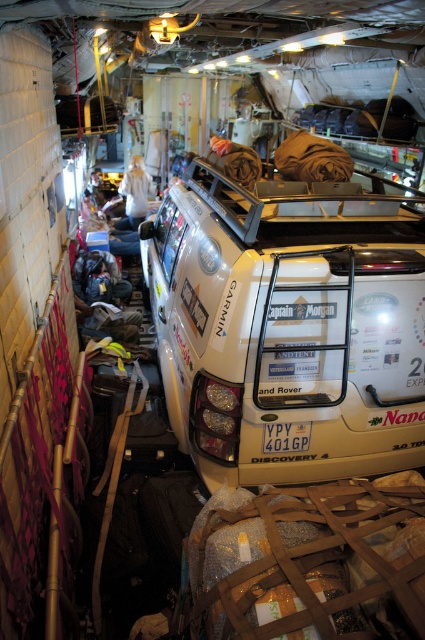
Question: Which object is farther from the camera taking this photo?

Choices:
 (A) white plastic license plate at center
 (B) white matte suv at center

Answer: (A)

Question: Which point appears closest to the camera in this image?

Choices:
 (A) (300, 426)
 (B) (322, 198)

Answer: (B)

Question: Does white matte suv at center have a smaller size compared to white plastic license plate at center?

Choices:
 (A) yes
 (B) no

Answer: (B)

Question: Is white matte suv at center to the left of white plastic license plate at center from the viewer's perspective?

Choices:
 (A) no
 (B) yes

Answer: (B)

Question: Considering the relative positions of white matte suv at center and white plastic license plate at center in the image provided, where is white matte suv at center located with respect to white plastic license plate at center?

Choices:
 (A) right
 (B) left

Answer: (B)